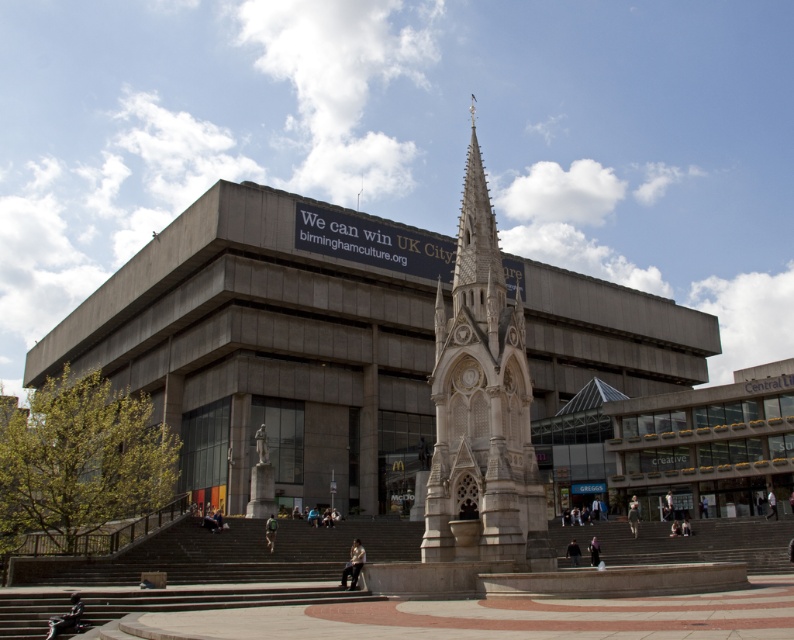
You are standing in the public square and want to place your dark blue fabric at lower center near the camouflage fabric backpack at lower center. Which direction should you move to place it next to the backpack?

The camouflage fabric backpack at lower center is to the left of dark blue fabric at lower center, so to place the dark blue fabric at lower center next to the backpack, you should move it to the left.

You are standing at the point marked as point (210, 572) in the image. What object is located at this point?

The concrete stairs at center is located at point (210, 572).

You are a delivery person carrying a large box that is 1.2 meters wide. You need to navigate through the public square to reach the modern building. Can you pass through the area between the concrete stairs at center and the dark gray jacket at lower left without tilting the box?

The concrete stairs at center might be wider than dark gray jacket at lower left, but since the exact width isn